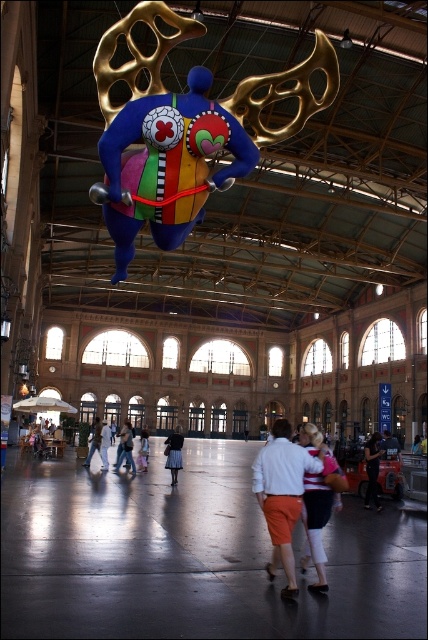
Between dark blue jeans at center and white cotton dress at center, which one appears on the left side from the viewer's perspective?

From the viewer's perspective, white cotton dress at center appears more on the left side.

Image resolution: width=428 pixels, height=640 pixels. What do you see at coordinates (372, 468) in the screenshot?
I see `dark blue jeans at center` at bounding box center [372, 468].

Is point (376, 477) farther from camera compared to point (95, 426)?

No, it is not.

You are a GUI agent. You are given a task and a screenshot of the screen. Output one action in this format:
    pyautogui.click(x=<x>, y=<y>)
    Task: Click on the dark blue jeans at center
    This screenshot has height=640, width=428.
    Given the screenshot: What is the action you would take?
    pyautogui.click(x=372, y=468)

Is white matte jacket at lower center positioned at the back of orange skirt at center?

No, it is not.

Which is more to the right, white matte jacket at lower center or orange skirt at center?

Positioned to the right is white matte jacket at lower center.

Locate an element on the screen. The height and width of the screenshot is (640, 428). white matte jacket at lower center is located at coordinates (318, 516).

Can you confirm if blue fabric balloon at center is positioned to the left of white cotton dress at center?

Incorrect, blue fabric balloon at center is not on the left side of white cotton dress at center.

Is point (151, 221) behind point (91, 452)?

No, (151, 221) is in front of (91, 452).

Find the location of a particular element. This screenshot has width=428, height=640. blue fabric balloon at center is located at coordinates (184, 131).